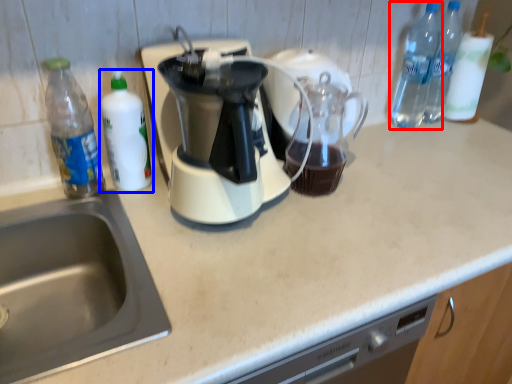
Question: Among these objects, which one is nearest to the camera, bottle (highlighted by a red box) or bottle (highlighted by a blue box)?

Choices:
 (A) bottle
 (B) bottle

Answer: (B)